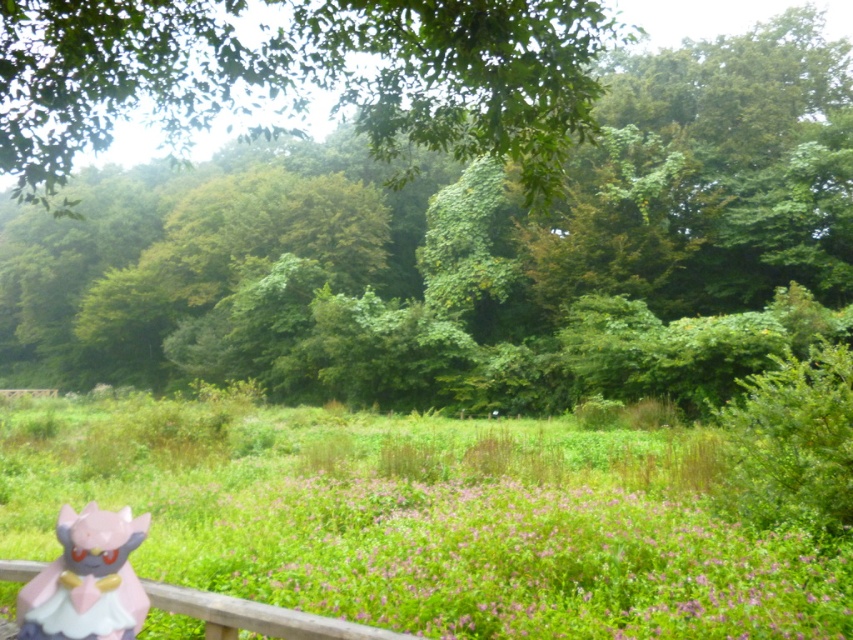
Question: Which object is farther from the camera taking this photo?

Choices:
 (A) green leafy tree at upper center
 (B) green grassy field at center
 (C) wooden at lower left
 (D) pink glossy figurine at lower left

Answer: (B)

Question: Which point is closer to the camera taking this photo?

Choices:
 (A) (21, 589)
 (B) (367, 637)
 (C) (160, 61)
 (D) (383, 40)

Answer: (B)

Question: Is green grassy field at center closer to the viewer compared to wooden at lower left?

Choices:
 (A) no
 (B) yes

Answer: (A)

Question: Which object is positioned farthest from the wooden at lower left?

Choices:
 (A) pink glossy figurine at lower left
 (B) green grassy field at center
 (C) green leafy tree at upper center
 (D) green leafy tree at center

Answer: (C)

Question: Does pink glossy figurine at lower left lie behind wooden at lower left?

Choices:
 (A) no
 (B) yes

Answer: (B)

Question: Is green grassy field at center closer to camera compared to wooden at lower left?

Choices:
 (A) yes
 (B) no

Answer: (B)